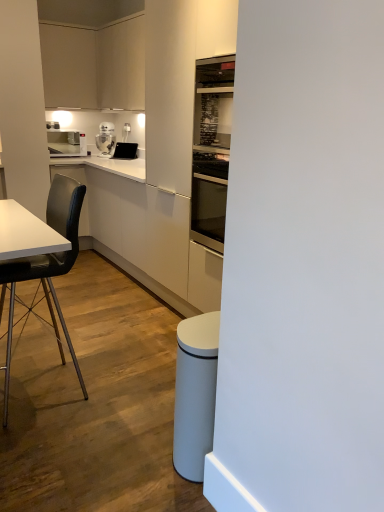
Where is `free spot in front of black matte chair at left`? free spot in front of black matte chair at left is located at coordinates (54, 442).